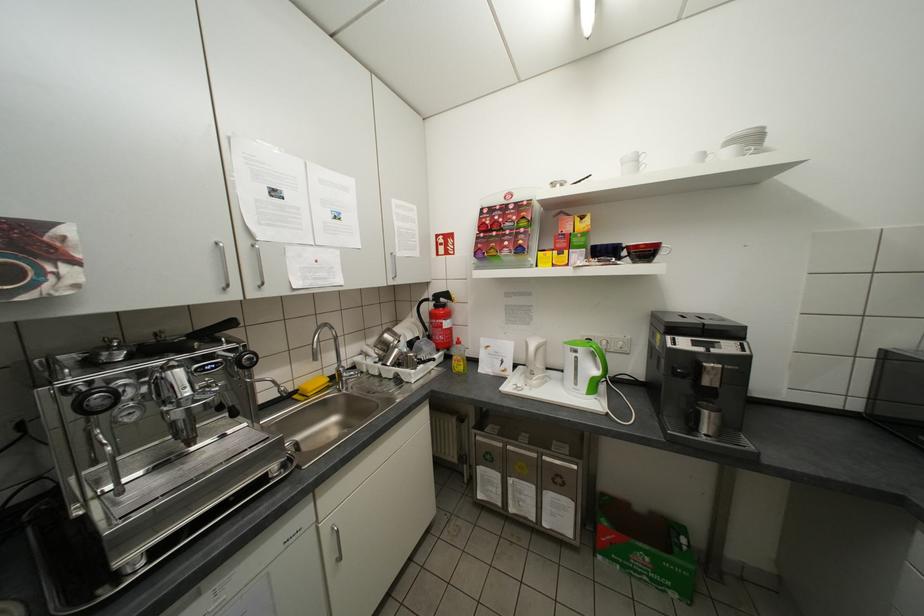
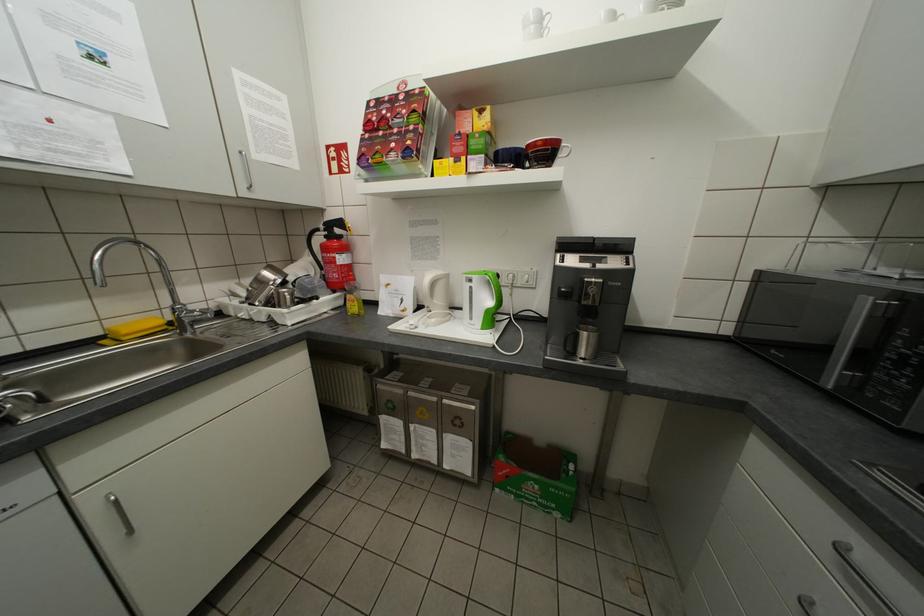
Find the pixel in the second image that matches point 523,342 in the first image.

(423, 277)